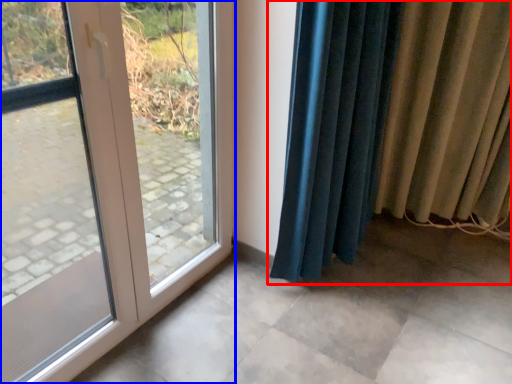
Question: Which of the following is the closest to the observer, curtain (highlighted by a red box) or door (highlighted by a blue box)?

Choices:
 (A) curtain
 (B) door

Answer: (B)